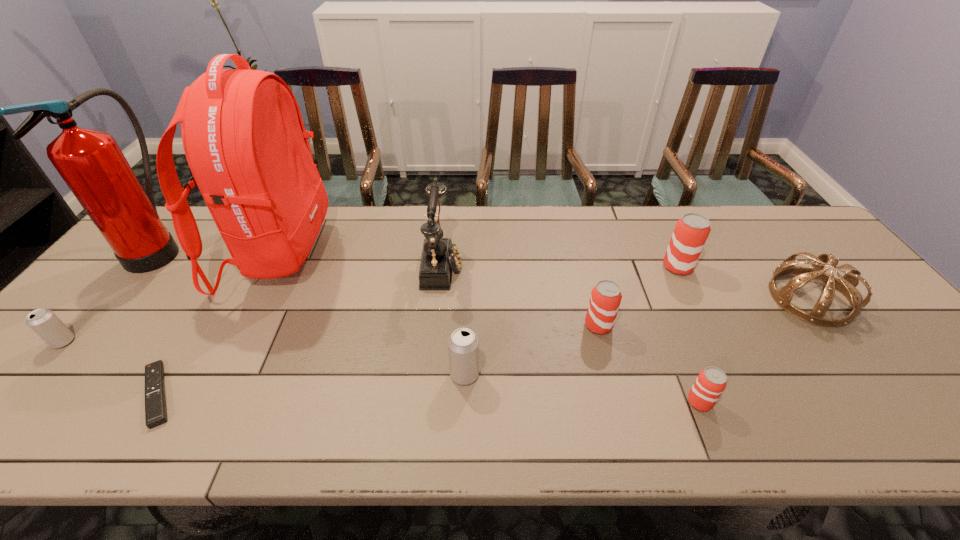
The image size is (960, 540). Identify the location of vacant area that satisfies the following two spatial constraints: 1. on the dial of the tiara; 2. on the right side of the third tallest object. (439, 299).